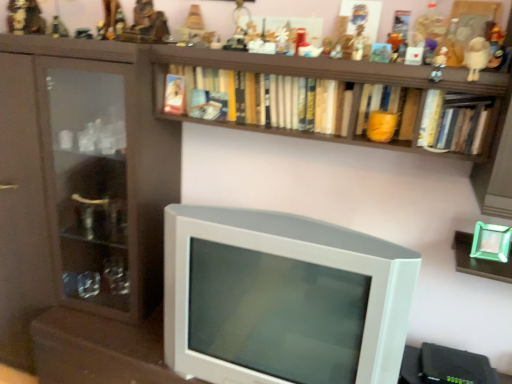
Question: Which direction should I rotate to face matte plastic figurine at upper center, the ninth toy positioned from the left, — up or down?

Choices:
 (A) up
 (B) down

Answer: (A)

Question: From a real-world perspective, is metallic figurine at upper center, the ninth toy from the right, located beneath matte plastic toy at upper center, which appears as the eighth toy when viewed from the left?

Choices:
 (A) yes
 (B) no

Answer: (A)

Question: From the image's perspective, is metallic figurine at upper center, the ninth toy from the right, over matte plastic toy at upper center, marked as the 4th toy in a right-to-left arrangement?

Choices:
 (A) yes
 (B) no

Answer: (A)

Question: Is metallic figurine at upper center, the ninth toy from the right, bigger than matte plastic toy at upper center, marked as the 4th toy in a right-to-left arrangement?

Choices:
 (A) no
 (B) yes

Answer: (A)

Question: Can you confirm if metallic figurine at upper center, the third toy viewed from the left, is wider than matte plastic toy at upper center, which appears as the eighth toy when viewed from the left?

Choices:
 (A) no
 (B) yes

Answer: (B)

Question: Could matte plastic toy at upper center, marked as the 4th toy in a right-to-left arrangement, be considered to be inside metallic figurine at upper center, the ninth toy from the right?

Choices:
 (A) no
 (B) yes

Answer: (A)

Question: Is metallic figurine at upper center, the ninth toy from the right, behind matte plastic toy at upper center, marked as the 4th toy in a right-to-left arrangement?

Choices:
 (A) yes
 (B) no

Answer: (A)

Question: Is metallic gold figurine at upper center, which appears as the 5th toy when viewed from the left, oriented away from white plastic figurine at upper right, placed as the first toy when sorted from right to left?

Choices:
 (A) yes
 (B) no

Answer: (B)

Question: Does metallic gold figurine at upper center, which appears as the 5th toy when viewed from the left, lie behind white plastic figurine at upper right, which appears as the eleventh toy when viewed from the left?

Choices:
 (A) no
 (B) yes

Answer: (B)

Question: From a real-world perspective, is metallic gold figurine at upper center, which ranks as the seventh toy in right-to-left order, over white plastic figurine at upper right, placed as the first toy when sorted from right to left?

Choices:
 (A) yes
 (B) no

Answer: (A)

Question: Considering the relative positions of metallic gold figurine at upper center, which ranks as the seventh toy in right-to-left order, and white plastic figurine at upper right, which appears as the eleventh toy when viewed from the left, in the image provided, is metallic gold figurine at upper center, which ranks as the seventh toy in right-to-left order, to the right of white plastic figurine at upper right, which appears as the eleventh toy when viewed from the left, from the viewer's perspective?

Choices:
 (A) no
 (B) yes

Answer: (A)

Question: Does metallic gold figurine at upper center, which ranks as the seventh toy in right-to-left order, have a lesser height compared to white plastic figurine at upper right, placed as the first toy when sorted from right to left?

Choices:
 (A) no
 (B) yes

Answer: (A)

Question: Is metallic gold figurine at upper center, which ranks as the seventh toy in right-to-left order, oriented towards white plastic figurine at upper right, placed as the first toy when sorted from right to left?

Choices:
 (A) no
 (B) yes

Answer: (A)

Question: Can you confirm if metallic gold figurine at upper left, which is the 11th toy from right to left, is wider than hardcover book at upper right, acting as the 3th book starting from the left?

Choices:
 (A) no
 (B) yes

Answer: (B)